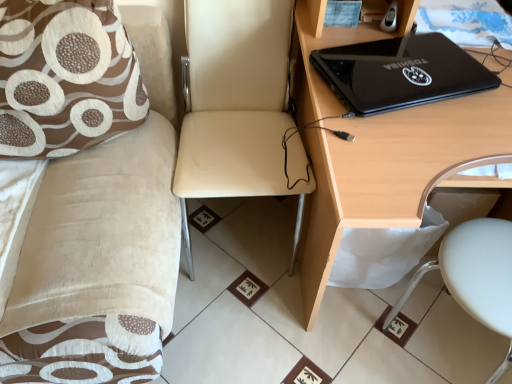
The height and width of the screenshot is (384, 512). Find the location of `free space to the left of white plastic swivel chair at lower right`. free space to the left of white plastic swivel chair at lower right is located at coordinates (333, 341).